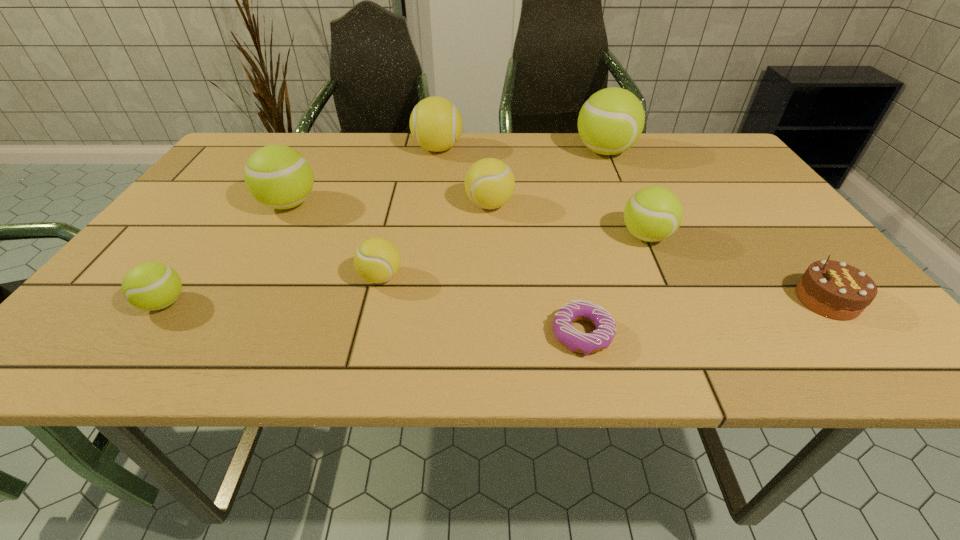
Find the location of a particular element. Image resolution: width=960 pixels, height=540 pixels. vacant space located on the back of the nearest yellow tennis ball is located at coordinates (396, 218).

Locate an element on the screen. Image resolution: width=960 pixels, height=540 pixels. vacant space situated on the right of the smallest green tennis ball is located at coordinates (276, 303).

The height and width of the screenshot is (540, 960). What are the coordinates of `vacant position located on the left of the chocolate cake` in the screenshot? It's located at (658, 300).

Locate an element on the screen. vacant space located 0.210m on the left of the purple doughnut is located at coordinates (434, 334).

This screenshot has height=540, width=960. What are the coordinates of `object located in the near edge section of the desktop` in the screenshot? It's located at (576, 341).

What are the coordinates of `object located in the left edge section of the desktop` in the screenshot? It's located at (151, 286).

This screenshot has height=540, width=960. I want to click on object that is at the right edge, so click(x=833, y=289).

The image size is (960, 540). I want to click on vacant area at the far edge, so click(571, 149).

Locate an element on the screen. The height and width of the screenshot is (540, 960). vacant area at the near edge is located at coordinates (297, 332).

The width and height of the screenshot is (960, 540). In order to click on free location at the left edge of the desktop in this screenshot , I will do `click(218, 202)`.